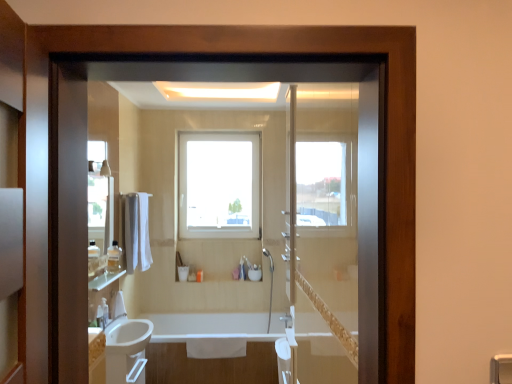
Describe the element at coordinates (99, 197) in the screenshot. The height and width of the screenshot is (384, 512). I see `clear glass mirror at upper left` at that location.

Measure the distance between point (108, 316) and camera.

Point (108, 316) and camera are 3.06 meters apart from each other.

Locate an element on the screen. This screenshot has height=384, width=512. transparent glass window at center is located at coordinates (219, 185).

This screenshot has width=512, height=384. What do you see at coordinates (219, 185) in the screenshot? I see `transparent glass window at center` at bounding box center [219, 185].

Image resolution: width=512 pixels, height=384 pixels. I want to click on clear glass mirror at upper left, so click(99, 197).

From the image's perspective, does clear plastic bottle at lower left, the 3th toiletry from the back, appear lower than transparent glass window at center?

Yes, from the image's perspective, clear plastic bottle at lower left, the 3th toiletry from the back, is below transparent glass window at center.

How distant is clear plastic bottle at lower left, positioned as the second toiletry in top-to-bottom order, from transparent glass window at center?

They are 1.91 meters apart.

Which of these two, clear plastic bottle at lower left, the third toiletry viewed from the right, or transparent glass window at center, is smaller?

clear plastic bottle at lower left, the third toiletry viewed from the right.

Which is in front, point (103, 313) or point (243, 145)?

Point (103, 313)

From the image's perspective, would you say clear glass shelf at left is positioned over translucent plastic bottle at left, the 2th toiletry from the left?

Incorrect, from the image's perspective, clear glass shelf at left is lower than translucent plastic bottle at left, the 2th toiletry from the left.

Find the location of `toiletry that is the 1st object to the left of the clear glass shelf at left, starting at the anchor`. toiletry that is the 1st object to the left of the clear glass shelf at left, starting at the anchor is located at coordinates (114, 257).

In the scene shown: Does clear glass shelf at left have a greater height compared to translucent plastic bottle at left, positioned as the third toiletry in bottom-to-top order?

No.

Is clear glass shelf at left not within translucent plastic bottle at left, which is the second toiletry in back-to-front order?

clear glass shelf at left is positioned outside translucent plastic bottle at left, which is the second toiletry in back-to-front order.

From the image's perspective, which is above, clear glass shelf at left or transparent glass window at center?

transparent glass window at center is shown above in the image.

Based on the photo, which object is more forward, clear glass shelf at left or transparent glass window at center?

clear glass shelf at left is more forward.

Consider the image. Which point is more forward, (114, 276) or (247, 207)?

The point (114, 276) is in front.

From a real-world perspective, is clear glass shelf at left positioned above or below transparent glass window at center?

In terms of real-world spatial position, clear glass shelf at left is below transparent glass window at center.

Who is smaller, clear plastic bottle at lower left, the 3th toiletry from the back, or white glossy bathtub at lower center?

Smaller between the two is clear plastic bottle at lower left, the 3th toiletry from the back.

From the white glossy bathtub at lower center, count the 3rd toiletry to the left and point to it. Please provide its 2D coordinates.

[(105, 311)]

Does clear plastic bottle at lower left, positioned as the second toiletry in top-to-bottom order, come in front of white glossy bathtub at lower center?

Yes, clear plastic bottle at lower left, positioned as the second toiletry in top-to-bottom order, is closer to the viewer.

Do you think clear plastic bottle at lower left, which is counted as the 1th toiletry, starting from the front, is within white glossy bathtub at lower center, or outside of it?

The correct answer is: outside.

From their relative heights in the image, would you say clear plastic bottle at lower left, which is counted as the first toiletry, starting from the left, is taller or shorter than white matte cup at center, arranged as the third toiletry when viewed from the top?

clear plastic bottle at lower left, which is counted as the first toiletry, starting from the left, is taller than white matte cup at center, arranged as the third toiletry when viewed from the top.

In the scene shown: Could you tell me if clear plastic bottle at lower left, which is counted as the first toiletry, starting from the left, is facing white matte cup at center, arranged as the third toiletry when viewed from the top?

No, clear plastic bottle at lower left, which is counted as the first toiletry, starting from the left, is not facing towards white matte cup at center, arranged as the third toiletry when viewed from the top.

Is clear plastic bottle at lower left, positioned as the second toiletry in top-to-bottom order, not within white matte cup at center, the third toiletry viewed from the front?

Absolutely, clear plastic bottle at lower left, positioned as the second toiletry in top-to-bottom order, is external to white matte cup at center, the third toiletry viewed from the front.

Which is in front, clear plastic bottle at lower left, which is counted as the first toiletry, starting from the left, or white matte cup at center, which is the first toiletry in right-to-left order?

Positioned in front is clear plastic bottle at lower left, which is counted as the first toiletry, starting from the left.

Does white glossy bathtub at lower center touch clear plastic bottle at lower left, which is counted as the first toiletry, starting from the left?

No, white glossy bathtub at lower center is not touching clear plastic bottle at lower left, which is counted as the first toiletry, starting from the left.

From the image's perspective, is white glossy bathtub at lower center located beneath clear plastic bottle at lower left, positioned as the second toiletry in top-to-bottom order?

Indeed, from the image's perspective, white glossy bathtub at lower center is shown beneath clear plastic bottle at lower left, positioned as the second toiletry in top-to-bottom order.

Considering the relative positions of white glossy bathtub at lower center and clear plastic bottle at lower left, the third toiletry viewed from the right, in the image provided, is white glossy bathtub at lower center to the right of clear plastic bottle at lower left, the third toiletry viewed from the right, from the viewer's perspective?

Yes.

Considering the sizes of white matte cup at center, which is counted as the 1th toiletry, starting from the back, and clear plastic bottle at lower left, which is the 2th toiletry in bottom-to-top order, in the image, is white matte cup at center, which is counted as the 1th toiletry, starting from the back, wider or thinner than clear plastic bottle at lower left, which is the 2th toiletry in bottom-to-top order,?

white matte cup at center, which is counted as the 1th toiletry, starting from the back, is wider than clear plastic bottle at lower left, which is the 2th toiletry in bottom-to-top order.

Can you confirm if white matte cup at center, the third toiletry viewed from the front, is smaller than clear plastic bottle at lower left, positioned as the second toiletry in top-to-bottom order?

Incorrect, white matte cup at center, the third toiletry viewed from the front, is not smaller in size than clear plastic bottle at lower left, positioned as the second toiletry in top-to-bottom order.

Would you say white matte cup at center, which is counted as the 1th toiletry, starting from the back, contains clear plastic bottle at lower left, which is counted as the 1th toiletry, starting from the front?

That's incorrect, clear plastic bottle at lower left, which is counted as the 1th toiletry, starting from the front, is not inside white matte cup at center, which is counted as the 1th toiletry, starting from the back.

Is white matte cup at center, which is counted as the 1th toiletry, starting from the back, aimed at clear plastic bottle at lower left, which is the 2th toiletry in bottom-to-top order?

No, white matte cup at center, which is counted as the 1th toiletry, starting from the back, is not aimed at clear plastic bottle at lower left, which is the 2th toiletry in bottom-to-top order.

You are a GUI agent. You are given a task and a screenshot of the screen. Output one action in this format:
    pyautogui.click(x=<x>, y=<y>)
    Task: Click on the window above the clear plastic bottle at lower left, which is counted as the 1th toiletry, starting from the front (from the image's perspective)
    
    Given the screenshot: What is the action you would take?
    pyautogui.click(x=219, y=185)

Where is `toiletry above the clear glass shelf at left (from a real-world perspective)`? The width and height of the screenshot is (512, 384). toiletry above the clear glass shelf at left (from a real-world perspective) is located at coordinates (114, 257).

Estimate the real-world distances between objects in this image. Which object is further from white glossy bathtub at lower center, clear glass shelf at left or clear plastic bottle at lower left, which is the 2th toiletry in bottom-to-top order?

clear plastic bottle at lower left, which is the 2th toiletry in bottom-to-top order.

Estimate the real-world distances between objects in this image. Which object is closer to translucent plastic bottle at left, which is the second toiletry in back-to-front order, transparent glass window at center or clear glass mirror at upper left?

clear glass mirror at upper left lies closer to translucent plastic bottle at left, which is the second toiletry in back-to-front order, than the other object.

When comparing their distances from clear glass shelf at left, does transparent glass window at center or clear plastic bottle at lower left, which is counted as the first toiletry, starting from the left, seem closer?

Based on the image, clear plastic bottle at lower left, which is counted as the first toiletry, starting from the left, appears to be nearer to clear glass shelf at left.

When comparing their distances from white glossy bathtub at lower center, does clear glass mirror at upper left or clear plastic bottle at lower left, which is the 2th toiletry in bottom-to-top order, seem further?

clear glass mirror at upper left lies further to white glossy bathtub at lower center than the other object.

Looking at this image, considering their positions, is white matte cup at center, which is the first toiletry in bottom-to-top order, positioned further to transparent glass window at center than clear glass shelf at left?

Among the two, clear glass shelf at left is located further to transparent glass window at center.

When comparing their distances from white matte cup at center, which is the first toiletry in bottom-to-top order, does clear glass shelf at left or clear glass mirror at upper left seem closer?

clear glass shelf at left is positioned closer to the anchor white matte cup at center, which is the first toiletry in bottom-to-top order.

Looking at this image, when comparing their distances from clear glass mirror at upper left, does clear plastic bottle at lower left, which is counted as the 1th toiletry, starting from the front, or translucent plastic bottle at left, positioned as the third toiletry in bottom-to-top order, seem closer?

translucent plastic bottle at left, positioned as the third toiletry in bottom-to-top order, is closer to clear glass mirror at upper left.

Which object lies further to the anchor point clear glass shelf at left, white glossy bathtub at lower center or white matte cup at center, which appears as the 3th toiletry when viewed from the left?

white matte cup at center, which appears as the 3th toiletry when viewed from the left, is further to clear glass shelf at left.

I want to click on mirror between clear glass shelf at left and translucent plastic bottle at left, which is the second toiletry in back-to-front order, along the z-axis, so click(99, 197).

This screenshot has height=384, width=512. Find the location of `balustrade that lies between translucent plastic bottle at left, which is counted as the second toiletry, starting from the front, and white glossy bathtub at lower center from top to bottom`. balustrade that lies between translucent plastic bottle at left, which is counted as the second toiletry, starting from the front, and white glossy bathtub at lower center from top to bottom is located at coordinates (104, 280).

Where is `mirror positioned between clear glass shelf at left and white matte cup at center, which is the first toiletry in right-to-left order, from near to far`? This screenshot has width=512, height=384. mirror positioned between clear glass shelf at left and white matte cup at center, which is the first toiletry in right-to-left order, from near to far is located at coordinates (99, 197).

At what (x,y) coordinates should I click in order to perform the action: click on toiletry between clear plastic bottle at lower left, the 3th toiletry from the back, and white matte cup at center, the third toiletry viewed from the front, in the front-back direction. Please return your answer as a coordinate pair (x, y). Looking at the image, I should click on (114, 257).